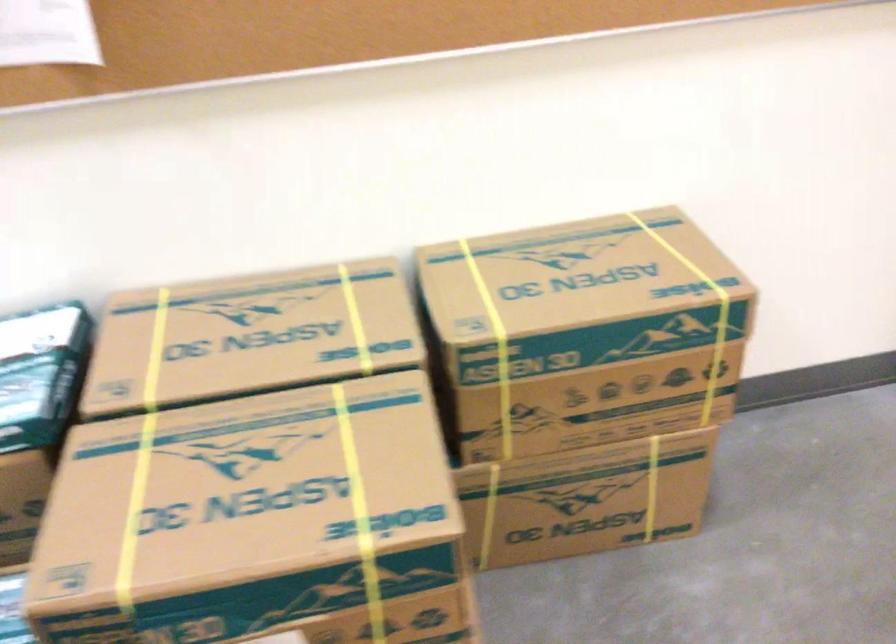
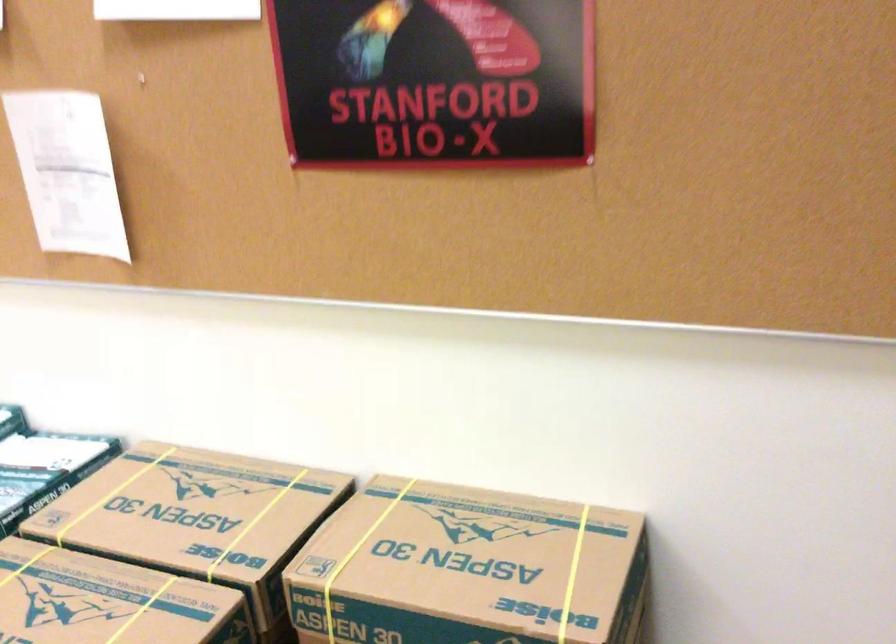
Locate, in the second image, the point that corresponds to pixel 682 260 in the first image.

(572, 574)